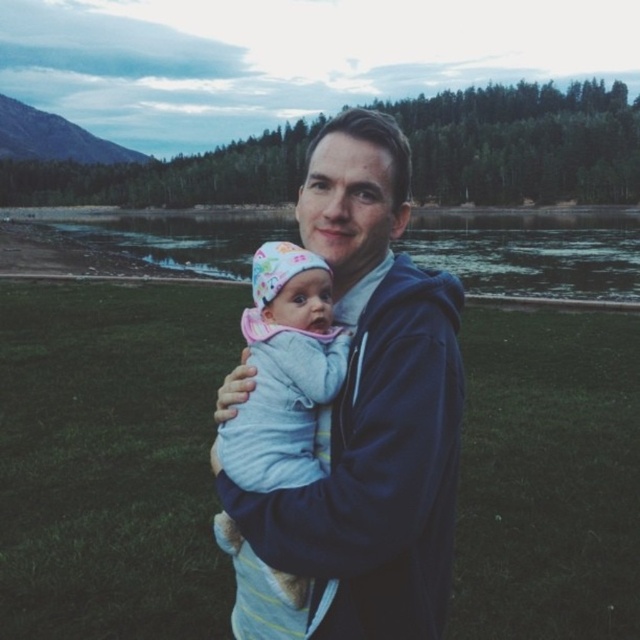
Question: Is dark blue hoodie at center behind light blue knit sweater at center?

Choices:
 (A) yes
 (B) no

Answer: (B)

Question: Can you confirm if dark blue hoodie at center is thinner than light blue knit sweater at center?

Choices:
 (A) yes
 (B) no

Answer: (B)

Question: Which point is farther from the camera taking this photo?

Choices:
 (A) (348, 212)
 (B) (232, 545)

Answer: (B)

Question: Is dark blue hoodie at center above light blue knit sweater at center?

Choices:
 (A) yes
 (B) no

Answer: (B)

Question: Which point is closer to the camera?

Choices:
 (A) dark blue hoodie at center
 (B) green grass at center
 (C) light blue knit sweater at center

Answer: (A)

Question: Which object is positioned farthest from the light blue knit sweater at center?

Choices:
 (A) green grass at center
 (B) dark blue hoodie at center

Answer: (A)